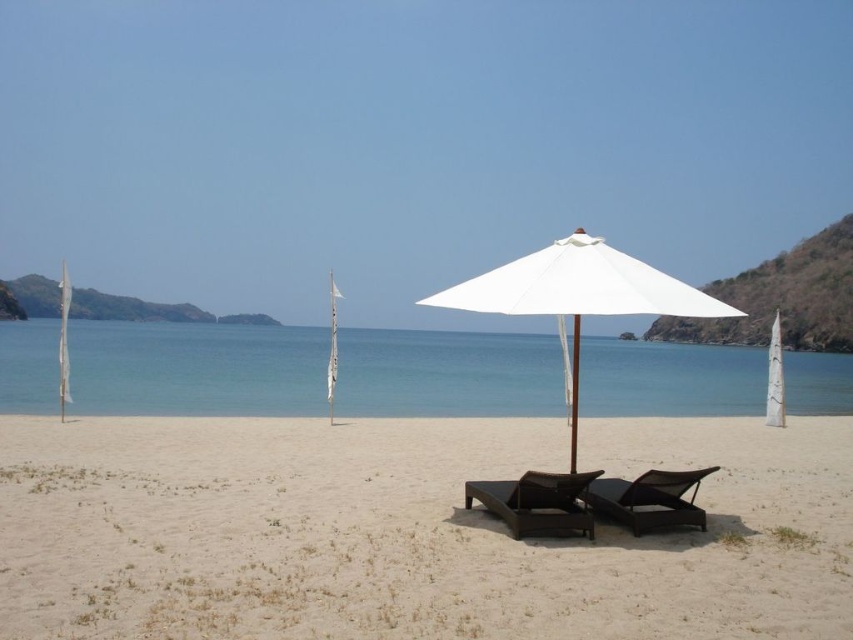
You are planning to set up a small tent on the beach. Given the white sand at center and the white fabric umbrella at center are both in the same area, which one would you choose to place the tent on and why?

You should place the tent on the white sand at center because it has a smaller size compared to the white fabric umbrella at center, making it a more stable and suitable surface for setting up the tent.

You are standing at the camera position and want to walk towards the white sand at center. How far will you have to walk to reach it?

The white sand at center is 5.58 meters away from the camera, so you will have to walk 5.58 meters to reach it.

You are a photographer setting up a shot of the beach scene. You want to capture the white sand at center and the white fabric umbrella at center in your frame. From your current position, which object will appear closer to you in the photo?

The white sand at center is in front of the white fabric umbrella at center, so it will appear closer to you in the photo.